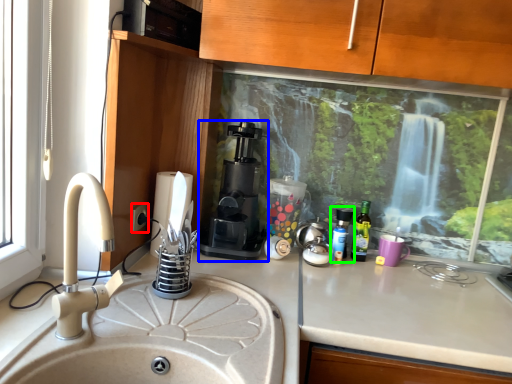
Question: Which object is the closest to the electric outlet (highlighted by a red box)? Choose among these: coffee machine (highlighted by a blue box) or bottle (highlighted by a green box).

Choices:
 (A) coffee machine
 (B) bottle

Answer: (A)